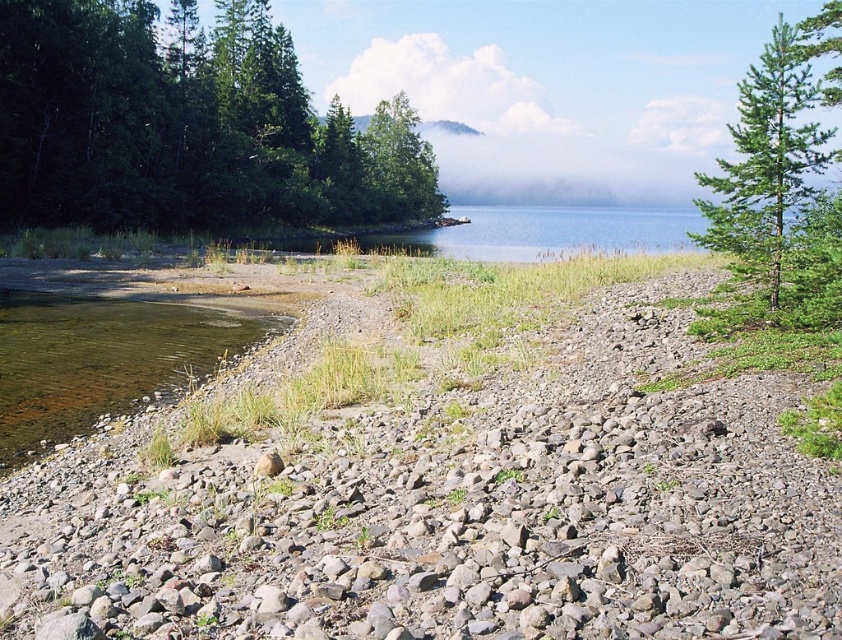
Looking at this image, you are standing on the pebbly beach and want to walk towards the dense forest beyond the water. Which object, the gray gravel at lower left or the green leafy tree at left, would you encounter first?

The gray gravel at lower left is in front of the green leafy tree at left, so you would encounter the gray gravel at lower left first before reaching the green leafy tree at left.

You are a hiker standing on the gray gravel at lower left and want to reach the green textured pine tree at upper right. Which direction should you move to get closer to the tree?

You should move upward because the gray gravel at lower left is below the green textured pine tree at upper right.